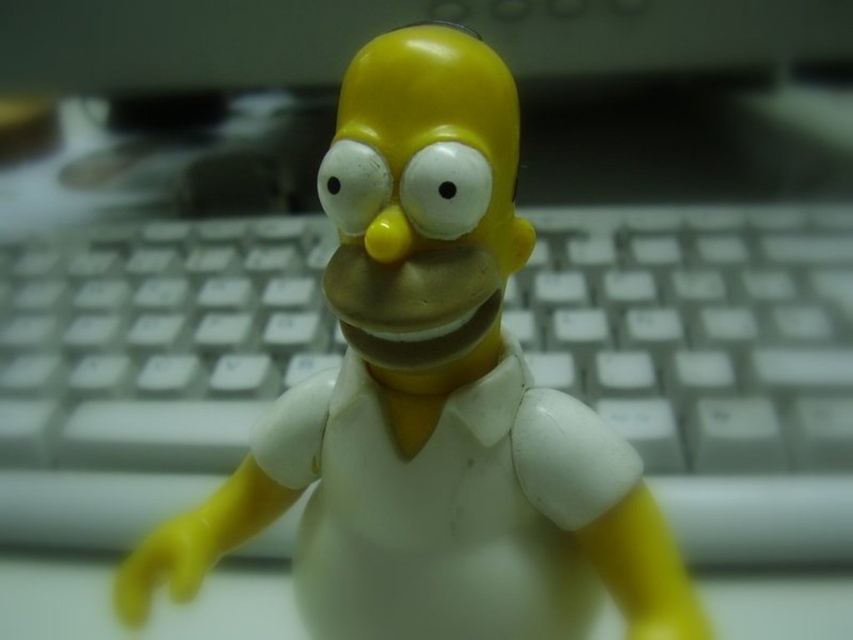
You are taking a photo of the Homer Simpson figurine and need to focus on both the point at point (148, 364) and the point at point (370, 260). Which point is closer to the camera?

Point (148, 364) is further to the camera than point (370, 260), so the point at point (370, 260) is closer to the camera.

You are organizing a desk and need to place the white plastic keyboard at center and the yellow matte figure at center. According to the image, which object is positioned higher?

The white plastic keyboard at center is positioned above the yellow matte figure at center according to the image.

You are organizing your desk and want to place the yellow matte figure at center closer to the white plastic keyboard at center. How much space is between them currently?

The white plastic keyboard at center and yellow matte figure at center are 10.97 inches apart from each other, so there is currently 10.97 inches of space between them.